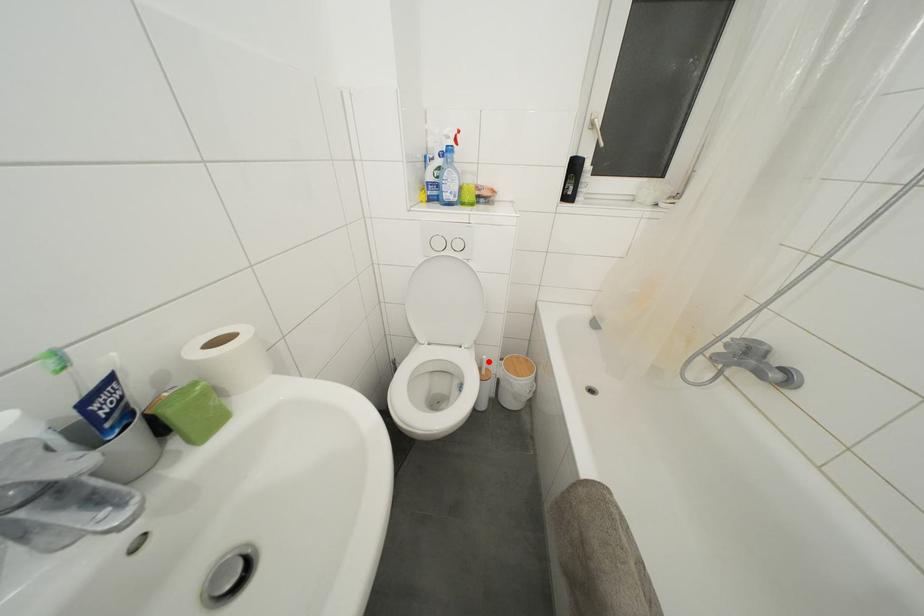
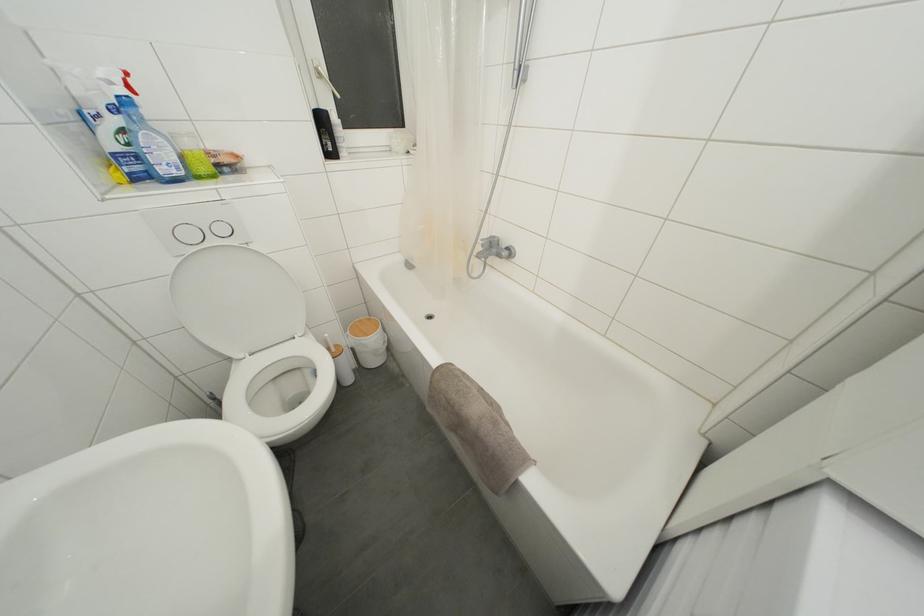
Find the pixel in the second image that matches the highlighted location in the first image.

(331, 339)